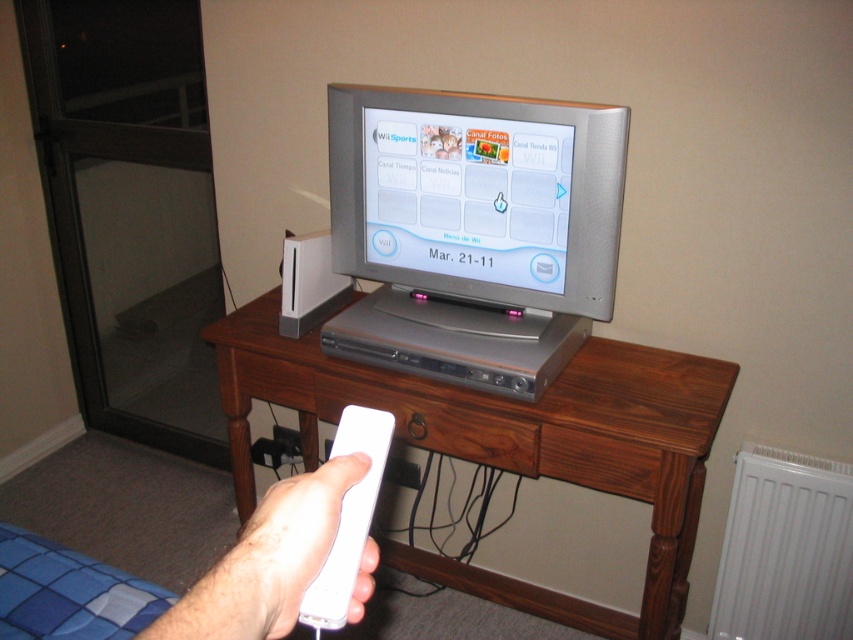
Is white matte remote control at lower center thinner than brown wood drawer at center?

Yes, white matte remote control at lower center is thinner than brown wood drawer at center.

Is white matte remote control at lower center smaller than brown wood drawer at center?

Yes, white matte remote control at lower center is smaller than brown wood drawer at center.

I want to click on white matte remote control at lower center, so click(287, 545).

How distant is white matte remote control at lower center from white matte game controller at center?

white matte remote control at lower center is 0.86 inches away from white matte game controller at center.

Can you confirm if white matte remote control at lower center is positioned below white matte game controller at center?

Correct, white matte remote control at lower center is located below white matte game controller at center.

Is point (285, 525) farther from camera compared to point (357, 570)?

No.

The width and height of the screenshot is (853, 640). I want to click on white matte remote control at lower center, so click(287, 545).

Is point (598, 614) closer to viewer compared to point (424, 433)?

No.

Can you confirm if brown wood table at center is thinner than brown wood drawer at center?

Incorrect, brown wood table at center's width is not less than brown wood drawer at center's.

Is point (640, 429) less distant than point (466, 454)?

Yes.

This screenshot has height=640, width=853. In order to click on brown wood table at center in this screenshot , I will do `click(508, 444)`.